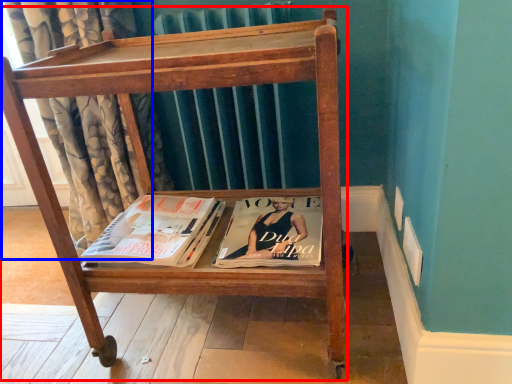
Question: Among these objects, which one is nearest to the camera, furniture (highlighted by a red box) or curtain (highlighted by a blue box)?

Choices:
 (A) furniture
 (B) curtain

Answer: (A)